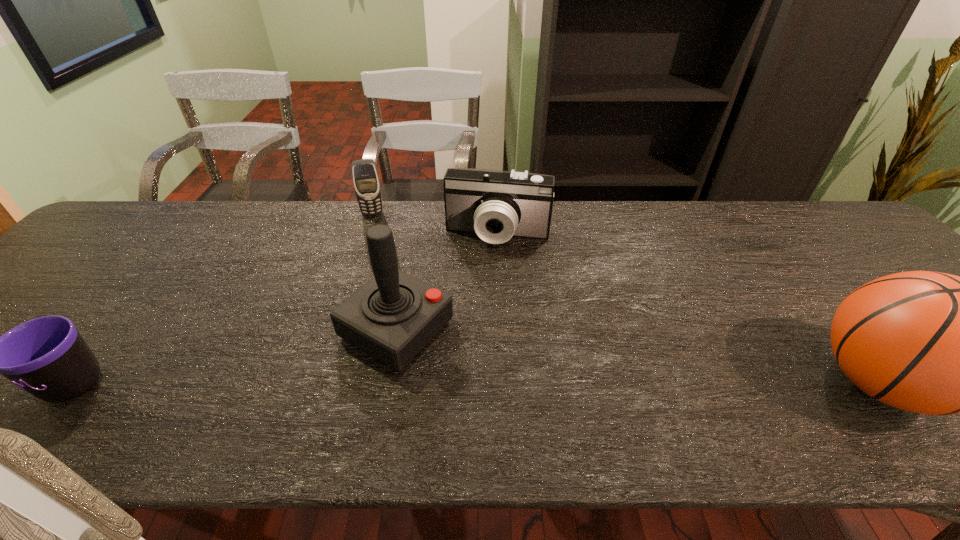
Locate which object ranks in proximity to the fourth nearest object. Please provide its 2D coordinates. Your answer should be formatted as a tuple, i.e. [(x, y)], where the tuple contains the x and y coordinates of a point satisfying the conditions above.

[(392, 317)]

The width and height of the screenshot is (960, 540). I want to click on free spot that satisfies the following two spatial constraints: 1. on the back side of the fourth nearest object; 2. on the right side of the joystick, so click(414, 235).

This screenshot has width=960, height=540. Find the location of `vacant space that satisfies the following two spatial constraints: 1. on the front side of the camcorder; 2. on the right side of the cellular telephone`. vacant space that satisfies the following two spatial constraints: 1. on the front side of the camcorder; 2. on the right side of the cellular telephone is located at coordinates (366, 235).